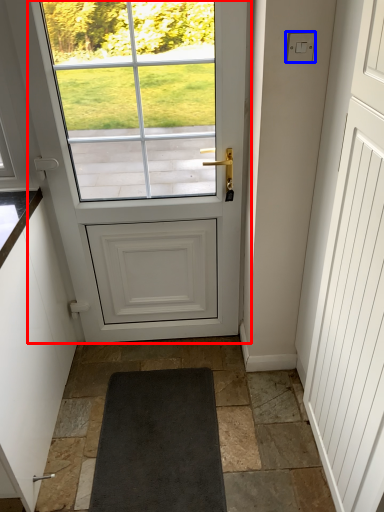
Question: Among these objects, which one is farthest to the camera, door (highlighted by a red box) or lock (highlighted by a blue box)?

Choices:
 (A) door
 (B) lock

Answer: (A)